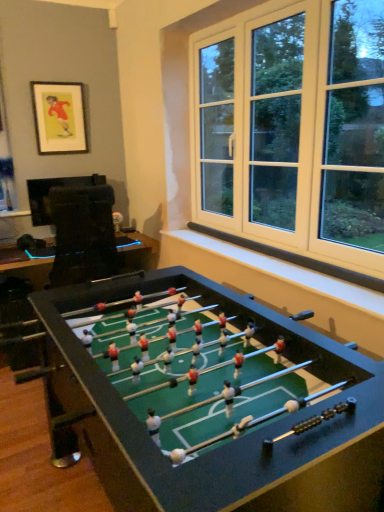
Locate an element on the screen. black glossy tv at left, positioned as the 1th table in top-to-bottom order is located at coordinates pos(26,267).

Which object is positioned more to the left, black glossy tv at left, the 2th table from the bottom, or green felt table at center, the first table in the bottom-to-top sequence?

black glossy tv at left, the 2th table from the bottom.

From a real-world perspective, is black glossy tv at left, the 2th table from the bottom, physically located above or below green felt table at center, the second table viewed from the top?

Clearly, from a real-world perspective, black glossy tv at left, the 2th table from the bottom, is above green felt table at center, the second table viewed from the top.

Is black glossy tv at left, the 2th table from the bottom, facing away from green felt table at center, the first table in the bottom-to-top sequence?

No, black glossy tv at left, the 2th table from the bottom, is not facing the opposite direction of green felt table at center, the first table in the bottom-to-top sequence.

Is matte black picture frame at upper left to the right of black glossy tv at left, the 2th table from the bottom, from the viewer's perspective?

No.

In the scene shown: How much distance is there between matte black picture frame at upper left and black glossy tv at left, positioned as the 1th table in top-to-bottom order?

1.07 meters.

Would you say matte black picture frame at upper left is a long distance from black glossy tv at left, the 2th table from the bottom?

Indeed, matte black picture frame at upper left is not near black glossy tv at left, the 2th table from the bottom.

Is the position of black glossy tv at left, the 2th table from the bottom, less distant than that of matte black picture frame at upper left?

Yes.

What's the angular difference between black glossy tv at left, positioned as the 1th table in top-to-bottom order, and matte black picture frame at upper left's facing directions?

They differ by 0.00353 degrees in their facing directions.

Who is taller, black glossy tv at left, positioned as the 1th table in top-to-bottom order, or matte black picture frame at upper left?

Standing taller between the two is matte black picture frame at upper left.

Between black glossy tv at left, positioned as the 1th table in top-to-bottom order, and matte black picture frame at upper left, which one appears on the right side from the viewer's perspective?

black glossy tv at left, positioned as the 1th table in top-to-bottom order.

Does point (37, 141) appear closer or farther from the camera than point (67, 420)?

Point (37, 141) is farther from the camera than point (67, 420).

Is matte black picture frame at upper left inside or outside of green felt table at center, the second table viewed from the top?

matte black picture frame at upper left is not inside green felt table at center, the second table viewed from the top, it's outside.

Looking at this image, considering the sizes of objects matte black picture frame at upper left and green felt table at center, the second table viewed from the top, in the image provided, who is wider, matte black picture frame at upper left or green felt table at center, the second table viewed from the top,?

green felt table at center, the second table viewed from the top, is wider.

Which object is closer to the camera taking this photo, matte black picture frame at upper left or green felt table at center, the first table in the bottom-to-top sequence?

Positioned in front is green felt table at center, the first table in the bottom-to-top sequence.

Would you say matte black picture frame at upper left is part of green felt table at center, the second table viewed from the top,'s contents?

No, green felt table at center, the second table viewed from the top, does not contain matte black picture frame at upper left.

Does green felt table at center, the first table in the bottom-to-top sequence, have a greater height compared to matte black picture frame at upper left?

In fact, green felt table at center, the first table in the bottom-to-top sequence, may be shorter than matte black picture frame at upper left.

Does green felt table at center, the first table in the bottom-to-top sequence, have a smaller size compared to matte black picture frame at upper left?

Incorrect, green felt table at center, the first table in the bottom-to-top sequence, is not smaller in size than matte black picture frame at upper left.

In order to click on picture frame that appears above the green felt table at center, the second table viewed from the top (from the image's perspective) in this screenshot , I will do `click(59, 117)`.

From the image's perspective, is green felt table at center, the first table in the bottom-to-top sequence, on top of black glossy tv at left, positioned as the 1th table in top-to-bottom order?

No.

Could you measure the distance between green felt table at center, the first table in the bottom-to-top sequence, and black glossy tv at left, positioned as the 1th table in top-to-bottom order?

1.74 meters.

Is green felt table at center, the first table in the bottom-to-top sequence, not within black glossy tv at left, positioned as the 1th table in top-to-bottom order?

That's correct, green felt table at center, the first table in the bottom-to-top sequence, is outside of black glossy tv at left, positioned as the 1th table in top-to-bottom order.

The image size is (384, 512). Find the location of `table behind the green felt table at center, the first table in the bottom-to-top sequence`. table behind the green felt table at center, the first table in the bottom-to-top sequence is located at coordinates (26, 267).

Locate an element on the screen. The image size is (384, 512). table located in front of the black glossy tv at left, positioned as the 1th table in top-to-bottom order is located at coordinates (220, 412).

You are a GUI agent. You are given a task and a screenshot of the screen. Output one action in this format:
    pyautogui.click(x=<x>, y=<y>)
    Task: Click on the 1st table to the right when counting from the matte black picture frame at upper left
    The width and height of the screenshot is (384, 512).
    Given the screenshot: What is the action you would take?
    pyautogui.click(x=26, y=267)

When comparing their distances from black glossy tv at left, the 2th table from the bottom, does matte black picture frame at upper left or green felt table at center, the first table in the bottom-to-top sequence, seem further?

green felt table at center, the first table in the bottom-to-top sequence, is further to black glossy tv at left, the 2th table from the bottom.

When comparing their distances from black glossy tv at left, positioned as the 1th table in top-to-bottom order, does green felt table at center, the first table in the bottom-to-top sequence, or matte black picture frame at upper left seem further?

Based on the image, green felt table at center, the first table in the bottom-to-top sequence, appears to be further to black glossy tv at left, positioned as the 1th table in top-to-bottom order.

Based on their spatial positions, is black glossy tv at left, positioned as the 1th table in top-to-bottom order, or green felt table at center, the first table in the bottom-to-top sequence, further from matte black picture frame at upper left?

green felt table at center, the first table in the bottom-to-top sequence, lies further to matte black picture frame at upper left than the other object.

Estimate the real-world distances between objects in this image. Which object is further from matte black picture frame at upper left, green felt table at center, the second table viewed from the top, or black glossy tv at left, the 2th table from the bottom?

green felt table at center, the second table viewed from the top, is further to matte black picture frame at upper left.

Which object lies nearer to the anchor point green felt table at center, the first table in the bottom-to-top sequence, matte black picture frame at upper left or black glossy tv at left, the 2th table from the bottom?

The object closer to green felt table at center, the first table in the bottom-to-top sequence, is black glossy tv at left, the 2th table from the bottom.

Considering their positions, is black glossy tv at left, positioned as the 1th table in top-to-bottom order, positioned further to green felt table at center, the second table viewed from the top, than matte black picture frame at upper left?

matte black picture frame at upper left is positioned further to the anchor green felt table at center, the second table viewed from the top.

At what (x,y) coordinates should I click in order to perform the action: click on table between green felt table at center, the first table in the bottom-to-top sequence, and matte black picture frame at upper left, along the z-axis. Please return your answer as a coordinate pair (x, y). Looking at the image, I should click on (26, 267).